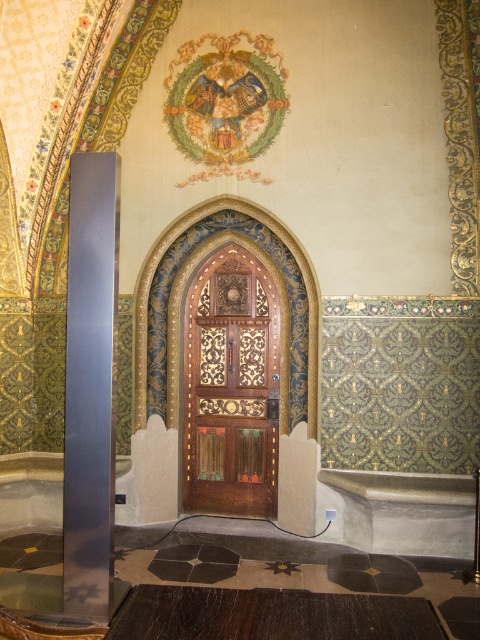
Question: Which point appears farthest from the camera in this image?

Choices:
 (A) (78, 477)
 (B) (183, 348)

Answer: (B)

Question: Does wooden carved door at center appear on the right side of satin silver pole at left?

Choices:
 (A) yes
 (B) no

Answer: (A)

Question: Observing the image, what is the correct spatial positioning of wooden carved door at center in reference to satin silver pole at left?

Choices:
 (A) left
 (B) right

Answer: (B)

Question: Which point is closer to the camera?

Choices:
 (A) (250, 317)
 (B) (76, 300)

Answer: (B)

Question: Can you confirm if wooden carved door at center is smaller than satin silver pole at left?

Choices:
 (A) no
 (B) yes

Answer: (A)